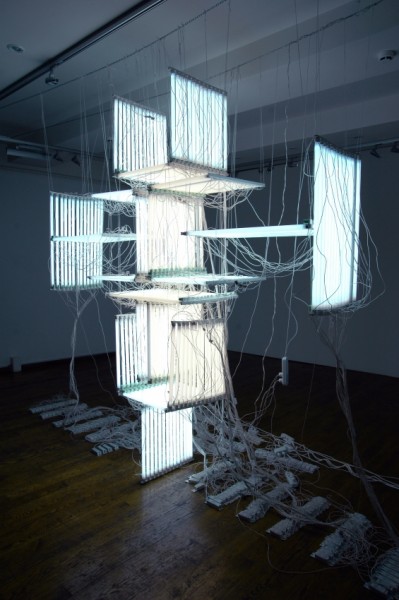
Where is `vertical light strips`? The height and width of the screenshot is (600, 399). vertical light strips is located at coordinates (62, 268), (142, 347), (200, 366), (173, 452), (324, 241), (151, 208), (145, 141), (201, 110).